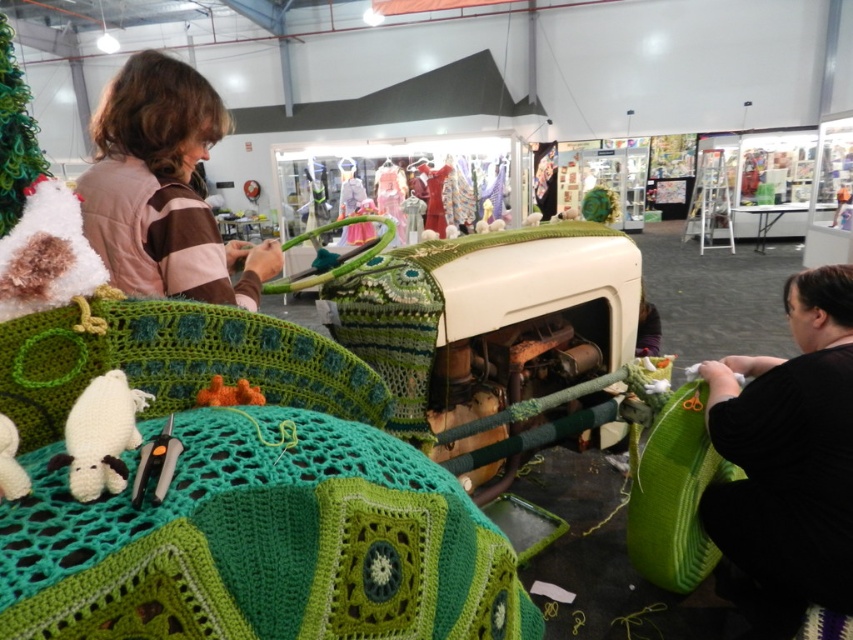
Is point (328, 454) more distant than point (776, 378)?

That is False.

Which of these two, green crocheted blanket at lower left or black fabric at lower right, stands shorter?

With less height is green crocheted blanket at lower left.

Who is more forward, [402,509] or [801,612]?

Positioned in front is point [402,509].

Identify the location of green crocheted blanket at lower left. The height and width of the screenshot is (640, 853). (263, 544).

Does point (15, 497) lie in front of point (204, 387)?

Yes, point (15, 497) is in front of point (204, 387).

Who is positioned more to the right, white plush sheep at lower left or fuzzy orange toy at center?

fuzzy orange toy at center

At what (x,y) coordinates should I click in order to perform the action: click on white plush sheep at lower left. Please return your answer as a coordinate pair (x, y). Image resolution: width=853 pixels, height=640 pixels. Looking at the image, I should click on (10, 461).

You are a GUI agent. You are given a task and a screenshot of the screen. Output one action in this format:
    pyautogui.click(x=<x>, y=<y>)
    Task: Click on the white plush sheep at lower left
    The width and height of the screenshot is (853, 640).
    Given the screenshot: What is the action you would take?
    pyautogui.click(x=10, y=461)

Can you confirm if green crocheted blanket at lower left is thinner than white yarn stuffed animal at lower left?

In fact, green crocheted blanket at lower left might be wider than white yarn stuffed animal at lower left.

Which is behind, point (323, 608) or point (105, 419)?

The point (323, 608) is behind.

At what (x,y) coordinates should I click in order to perform the action: click on green crocheted blanket at lower left. Please return your answer as a coordinate pair (x, y). This screenshot has height=640, width=853. Looking at the image, I should click on (263, 544).